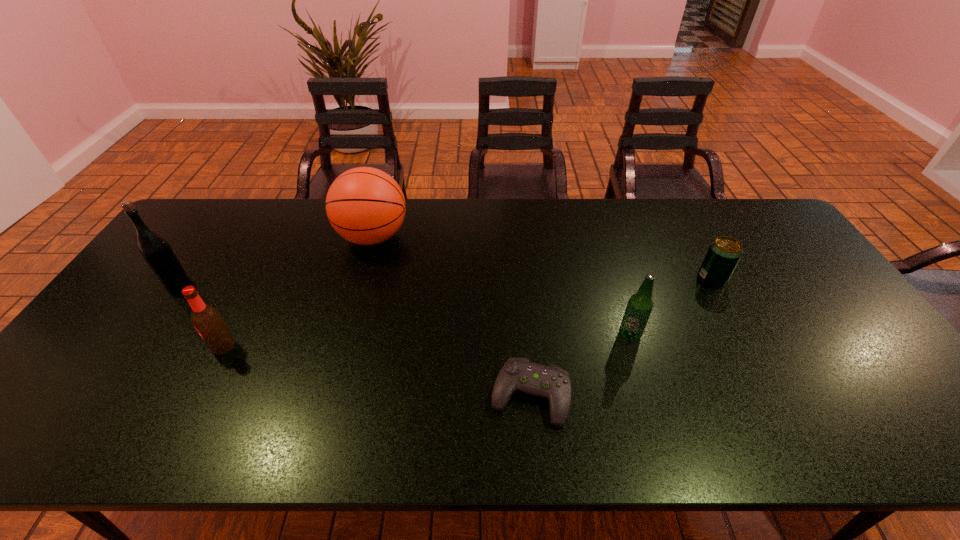
Point out which object is positioned as the fourth nearest to the tallest beer bottle. Please provide its 2D coordinates. Your answer should be formatted as a tuple, i.e. [(x, y)], where the tuple contains the x and y coordinates of a point satisfying the conditions above.

[(640, 305)]

Locate an element on the screen. beer bottle that is the closest one to the rightmost beer bottle is located at coordinates (207, 320).

Identify which beer bottle is located as the second nearest to the leftmost object. Please provide its 2D coordinates. Your answer should be formatted as a tuple, i.e. [(x, y)], where the tuple contains the x and y coordinates of a point satisfying the conditions above.

[(640, 305)]

This screenshot has width=960, height=540. In order to click on vacant space that satisfies the following two spatial constraints: 1. on the back side of the leftmost object; 2. on the left side of the third object from left to right in this screenshot , I will do `click(207, 237)`.

I want to click on free region that satisfies the following two spatial constraints: 1. on the front side of the shortest object; 2. on the right side of the second beer bottle from right to left, so click(198, 395).